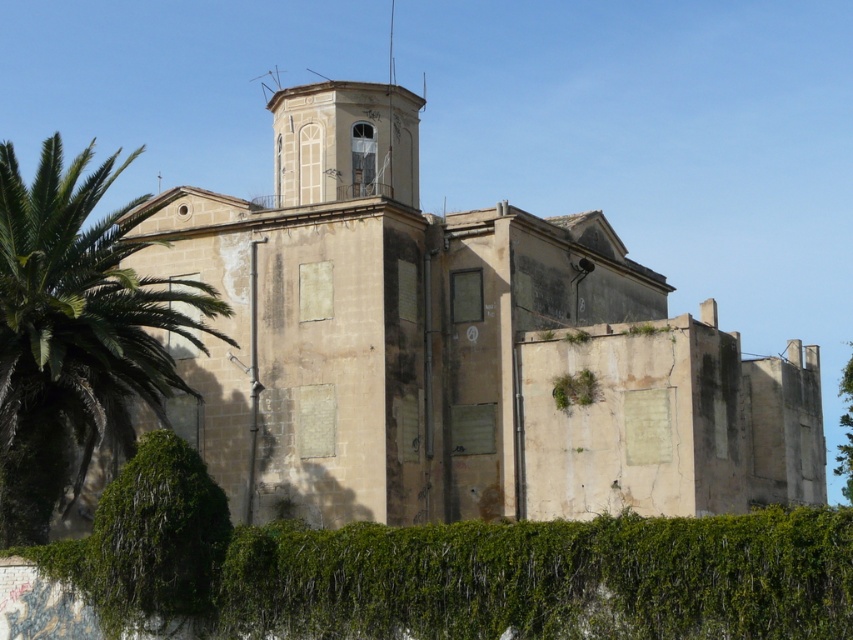
Between green leafy palm tree at left and green mossy hedge at lower left, which one appears on the left side from the viewer's perspective?

From the viewer's perspective, green leafy palm tree at left appears more on the left side.

Locate an element on the screen. The image size is (853, 640). green leafy palm tree at left is located at coordinates (74, 332).

Does green leafy hedge at lower center appear under white painted stone bell tower at upper center?

Yes.

Does green leafy hedge at lower center have a larger size compared to white painted stone bell tower at upper center?

Actually, green leafy hedge at lower center might be smaller than white painted stone bell tower at upper center.

Which is in front, point (431, 536) or point (393, 186)?

Point (431, 536) is in front.

Identify the location of green leafy hedge at lower center. (547, 579).

Based on the photo, is green leafy hedge at lower center thinner than green mossy hedge at lower left?

Incorrect, green leafy hedge at lower center's width is not less than green mossy hedge at lower left's.

Does green leafy hedge at lower center have a greater height compared to green mossy hedge at lower left?

Yes, green leafy hedge at lower center is taller than green mossy hedge at lower left.

Is point (317, 545) farther from viewer compared to point (198, 620)?

That is False.

Locate an element on the screen. The image size is (853, 640). green leafy hedge at lower center is located at coordinates (547, 579).